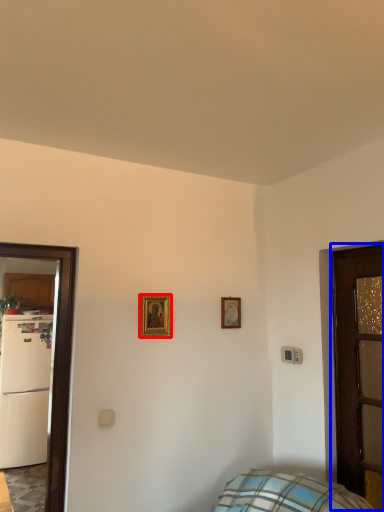
Question: Which point is closer to the camera, picture frame (highlighted by a red box) or door (highlighted by a blue box)?

Choices:
 (A) picture frame
 (B) door

Answer: (B)